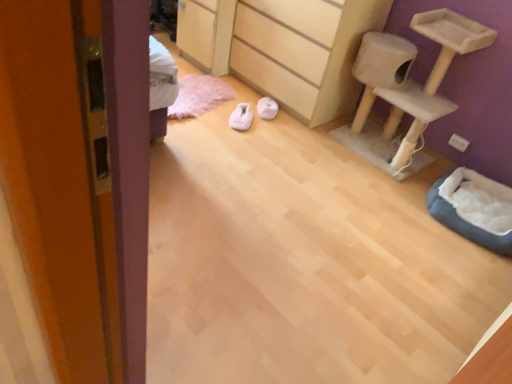
Question: In the image, is dark gray plush cat bed at lower right positioned in front of or behind light wood/texture chest of drawers at center?

Choices:
 (A) behind
 (B) front

Answer: (B)

Question: In terms of size, does dark gray plush cat bed at lower right appear bigger or smaller than light wood/texture chest of drawers at center?

Choices:
 (A) big
 (B) small

Answer: (B)

Question: Which object is the closest to the dark gray plush cat bed at lower right?

Choices:
 (A) white fabric slipper at center, which is the second footwear from left to right
 (B) beige carpeted cat tree at upper right
 (C) white fabric slipper at center, the second footwear positioned from the right
 (D) light wood/texture chest of drawers at center

Answer: (B)

Question: Which of these objects is positioned farthest from the dark gray plush cat bed at lower right?

Choices:
 (A) white fabric slipper at center, which is the second footwear from left to right
 (B) beige carpeted cat tree at upper right
 (C) white fabric slipper at center, arranged as the first footwear when viewed from the left
 (D) light wood/texture chest of drawers at center

Answer: (C)